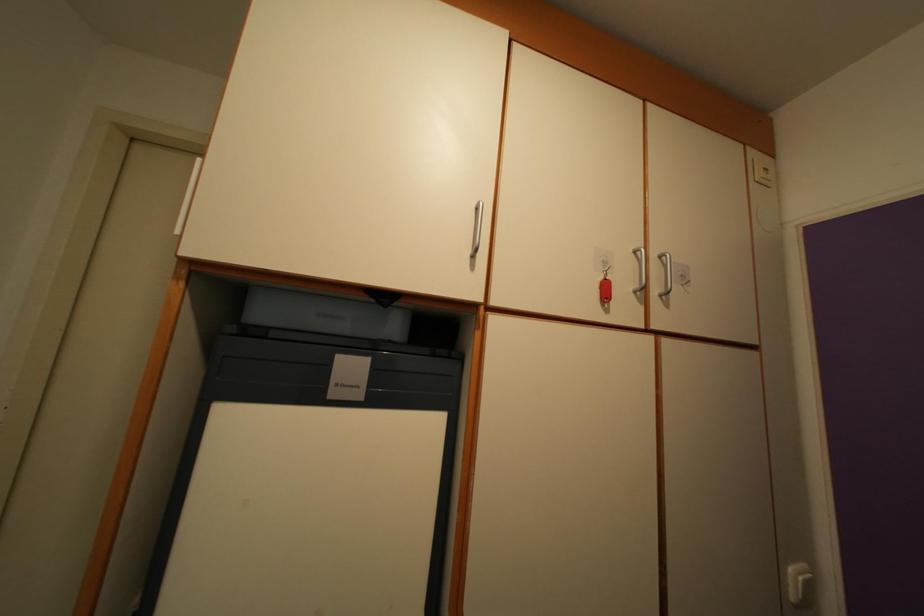
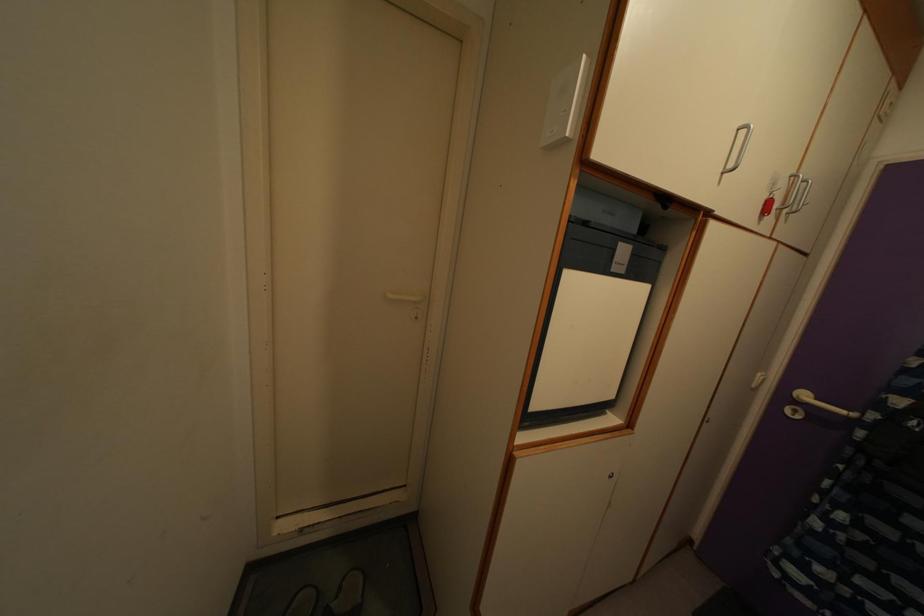
Question: The images are taken continuously from a first-person perspective. In which direction is your viewpoint rotating?

Choices:
 (A) Left
 (B) Right
 (C) Up
 (D) Down

Answer: (D)